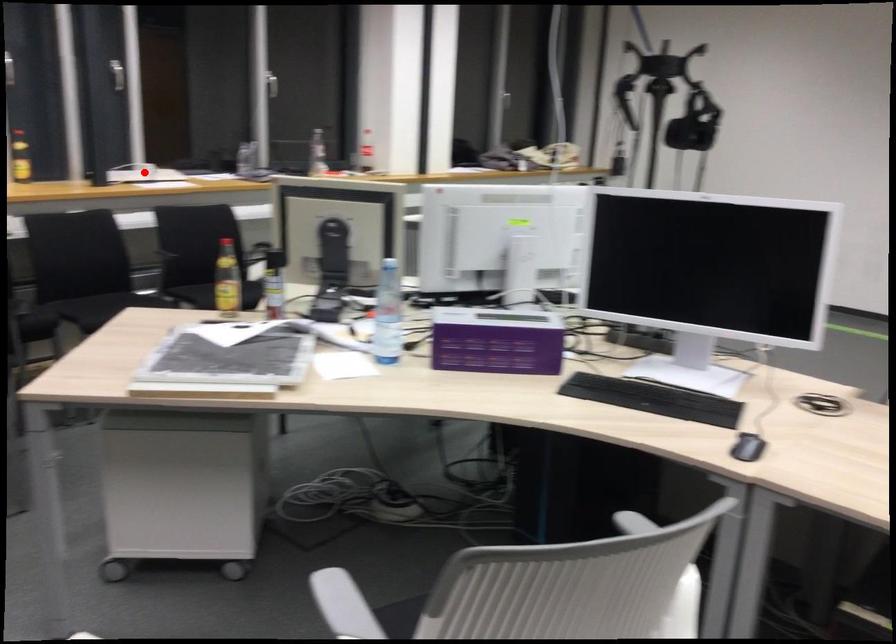
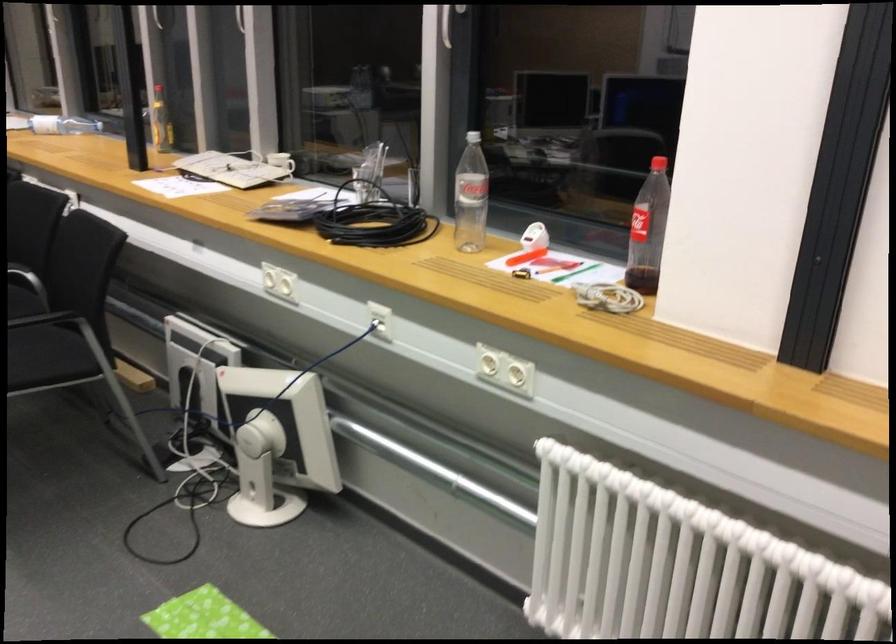
The point at the highlighted location is marked in the first image. Where is the corresponding point in the second image?

(280, 162)